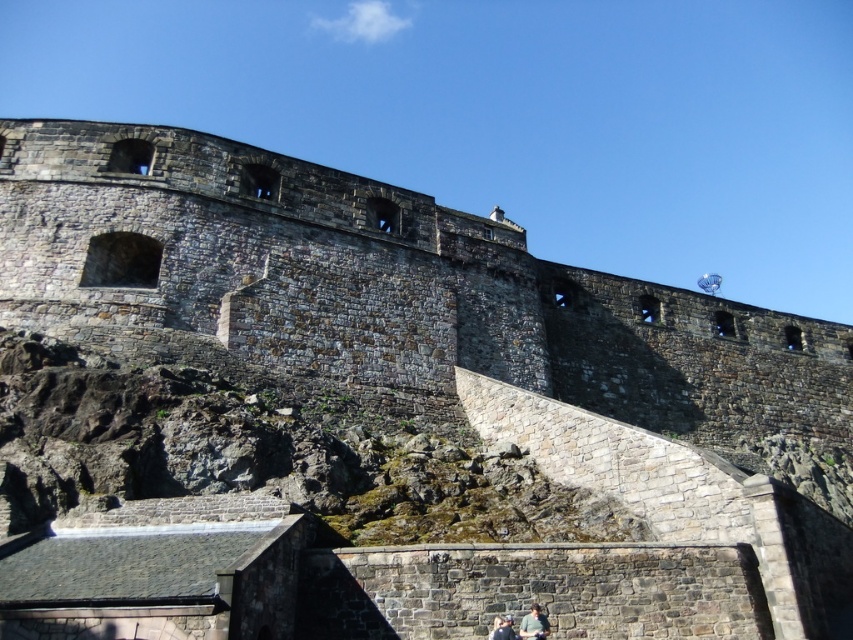
Looking at this image, you are a tour guide explaining the historical significance of Edinburgh Castle to a group. You notice two couples visiting the site. One is the green fabric couple at lower center and the other is the matte black couple at lower center. Which couple is wider?

The green fabric couple at lower center might be wider than the matte black couple at lower center.

Consider the image. You are a tour guide at Edinburgh Castle and want to point out two couples to your visitors. The first is the matte stone couple at lower center, and the second is the green fabric couple at lower center. Which of these two couples is bigger?

The matte stone couple at lower center is larger in size than the green fabric couple at lower center.

You are a tour guide at Edinburgh Castle and notice two couples visiting the historic fortress. The green fabric couple at lower center and the matte black couple at lower center are standing near the weathered stone wall. You need to inform them about the height restrictions for entering the arched openings in the wall. Which couple is more likely to fit through the openings without bending down?

The green fabric couple at lower center is taller than the matte black couple at lower center, so the matte black couple at lower center is shorter and more likely to fit through the openings without bending down.